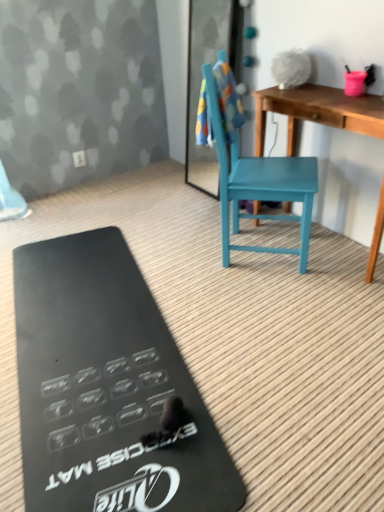
Find the location of a particular element. vacant area situated to the left side of teal wood chair at center is located at coordinates (185, 252).